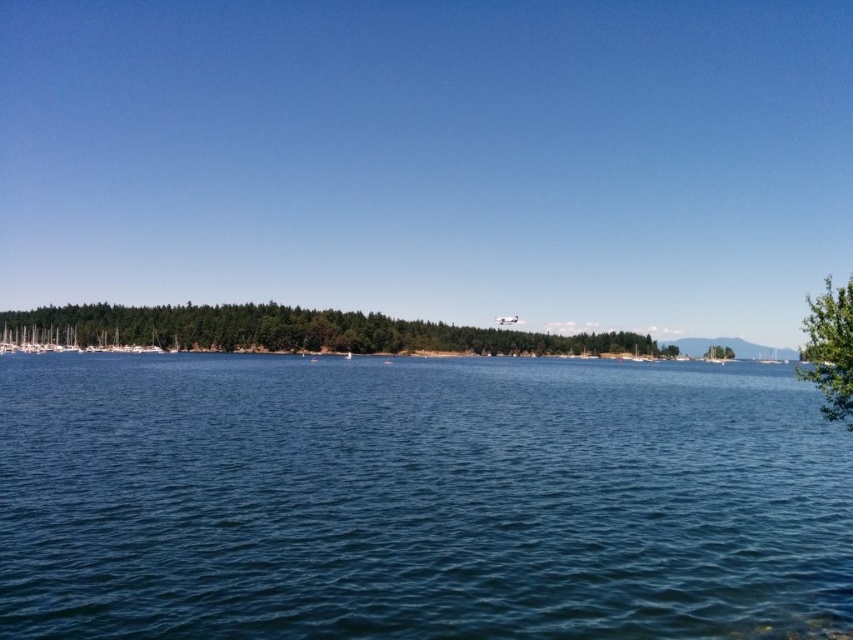
Question: Based on their relative distances, which object is nearer to the blue water at center?

Choices:
 (A) green leafy tree at center-right
 (B) green leafy tree at right
 (C) green leafy trees at center

Answer: (B)

Question: Which object is the closest to the green leafy tree at right?

Choices:
 (A) blue water at center
 (B) green leafy trees at center

Answer: (A)

Question: Which object appears closest to the camera in this image?

Choices:
 (A) green leafy tree at center-right
 (B) green leafy trees at center
 (C) blue water at center

Answer: (C)

Question: Observing the image, what is the correct spatial positioning of blue water at center in reference to green leafy trees at center?

Choices:
 (A) below
 (B) above

Answer: (A)

Question: Can you confirm if green leafy tree at right is positioned above green leafy tree at center-right?

Choices:
 (A) no
 (B) yes

Answer: (B)

Question: Can you confirm if blue water at center is positioned to the right of green leafy tree at right?

Choices:
 (A) yes
 (B) no

Answer: (B)